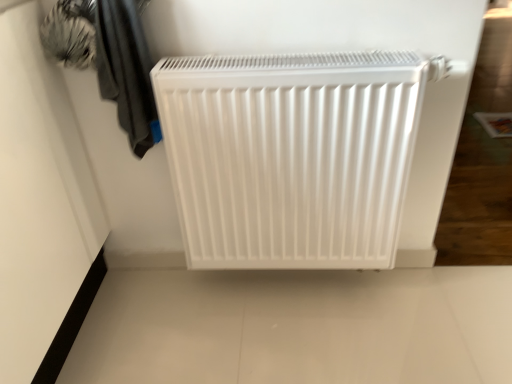
What do you see at coordinates (108, 59) in the screenshot? I see `dark gray fabric at upper left` at bounding box center [108, 59].

Identify the location of dark gray fabric at upper left. (108, 59).

What is the approximate height of white matte radiator at center?

white matte radiator at center is 25.55 inches in height.

Describe the element at coordinates (291, 155) in the screenshot. This screenshot has width=512, height=384. I see `white matte radiator at center` at that location.

Where is `white matte radiator at center`? The width and height of the screenshot is (512, 384). white matte radiator at center is located at coordinates (291, 155).

The width and height of the screenshot is (512, 384). I want to click on dark gray fabric at upper left, so click(x=108, y=59).

Between white matte radiator at center and dark gray fabric at upper left, which one appears on the left side from the viewer's perspective?

From the viewer's perspective, dark gray fabric at upper left appears more on the left side.

Is white matte radiator at center positioned in front of dark gray fabric at upper left?

That is False.

Does point (222, 262) lie behind point (119, 32)?

Yes, it is behind point (119, 32).

From the image's perspective, does white matte radiator at center appear lower than dark gray fabric at upper left?

Indeed, from the image's perspective, white matte radiator at center is shown beneath dark gray fabric at upper left.

From a real-world perspective, relative to dark gray fabric at upper left, is white matte radiator at center vertically above or below?

From a real-world perspective, white matte radiator at center is physically below dark gray fabric at upper left.

Is white matte radiator at center thinner than dark gray fabric at upper left?

Yes, white matte radiator at center is thinner than dark gray fabric at upper left.

Who is taller, white matte radiator at center or dark gray fabric at upper left?

Standing taller between the two is white matte radiator at center.

Considering the sizes of objects white matte radiator at center and dark gray fabric at upper left in the image provided, who is bigger, white matte radiator at center or dark gray fabric at upper left?

white matte radiator at center is bigger.

Would you say white matte radiator at center contains dark gray fabric at upper left?

No, white matte radiator at center does not contain dark gray fabric at upper left.

Is white matte radiator at center with dark gray fabric at upper left?

white matte radiator at center and dark gray fabric at upper left are clearly separated.

Could you tell me if white matte radiator at center is turned towards dark gray fabric at upper left?

No, white matte radiator at center is not turned towards dark gray fabric at upper left.

Measure the distance from white matte radiator at center to dark gray fabric at upper left.

white matte radiator at center and dark gray fabric at upper left are 11.76 inches apart.

You are a GUI agent. You are given a task and a screenshot of the screen. Output one action in this format:
    pyautogui.click(x=<x>, y=<y>)
    Task: Click on the home appliance behind the dark gray fabric at upper left
    The height and width of the screenshot is (384, 512).
    Given the screenshot: What is the action you would take?
    pyautogui.click(x=291, y=155)

Is dark gray fabric at upper left at the right side of white matte radiator at center?

Incorrect, dark gray fabric at upper left is not on the right side of white matte radiator at center.

Is dark gray fabric at upper left further to the viewer compared to white matte radiator at center?

→ No.

Which is more distant, (120, 112) or (298, 185)?

The point (298, 185) is behind.

From the image's perspective, is dark gray fabric at upper left positioned above or below white matte radiator at center?

From the image's perspective, dark gray fabric at upper left appears above white matte radiator at center.

From a real-world perspective, who is located lower, dark gray fabric at upper left or white matte radiator at center?

white matte radiator at center, from a real-world perspective.

Considering the relative sizes of dark gray fabric at upper left and white matte radiator at center in the image provided, is dark gray fabric at upper left wider than white matte radiator at center?

Correct, the width of dark gray fabric at upper left exceeds that of white matte radiator at center.

Between dark gray fabric at upper left and white matte radiator at center, which one has more height?

With more height is white matte radiator at center.

Considering the sizes of objects dark gray fabric at upper left and white matte radiator at center in the image provided, who is bigger, dark gray fabric at upper left or white matte radiator at center?

white matte radiator at center.

Can white matte radiator at center be found inside dark gray fabric at upper left?

No, dark gray fabric at upper left does not contain white matte radiator at center.

Is dark gray fabric at upper left not near white matte radiator at center?

dark gray fabric at upper left is near white matte radiator at center, not far away.

Is dark gray fabric at upper left oriented towards white matte radiator at center?

No, dark gray fabric at upper left is not facing towards white matte radiator at center.

How many degrees apart are the facing directions of dark gray fabric at upper left and white matte radiator at center?

The facing directions of dark gray fabric at upper left and white matte radiator at center are 0.144 degrees apart.

Identify the location of home appliance that appears below the dark gray fabric at upper left (from a real-world perspective). (291, 155).

Image resolution: width=512 pixels, height=384 pixels. In order to click on home appliance that appears below the dark gray fabric at upper left (from the image's perspective) in this screenshot , I will do `click(291, 155)`.

Locate an element on the screen. This screenshot has width=512, height=384. home appliance below the dark gray fabric at upper left (from a real-world perspective) is located at coordinates click(291, 155).